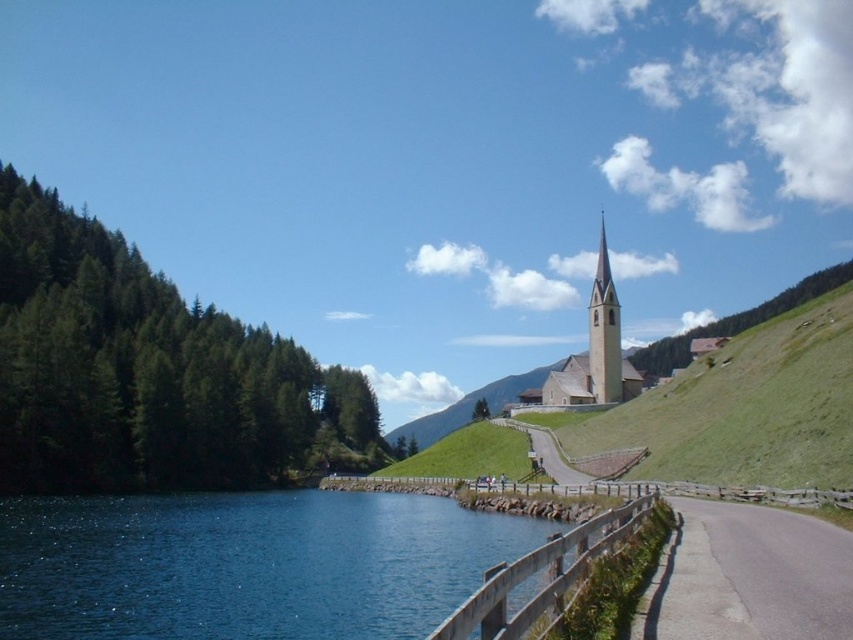
Question: Which point is closer to the camera?

Choices:
 (A) smooth beige church at center
 (B) blue water at lower left
 (C) smooth beige steeple at upper center

Answer: (B)

Question: Which is nearer to the smooth beige church at center?

Choices:
 (A) smooth beige steeple at upper center
 (B) blue water at lower left

Answer: (A)

Question: Is smooth beige church at center in front of smooth beige steeple at upper center?

Choices:
 (A) yes
 (B) no

Answer: (A)

Question: Estimate the real-world distances between objects in this image. Which object is closer to the blue water at lower left?

Choices:
 (A) smooth beige church at center
 (B) smooth beige steeple at upper center

Answer: (A)

Question: Is smooth beige church at center smaller than smooth beige steeple at upper center?

Choices:
 (A) no
 (B) yes

Answer: (A)

Question: Does blue water at lower left come in front of smooth beige steeple at upper center?

Choices:
 (A) no
 (B) yes

Answer: (B)